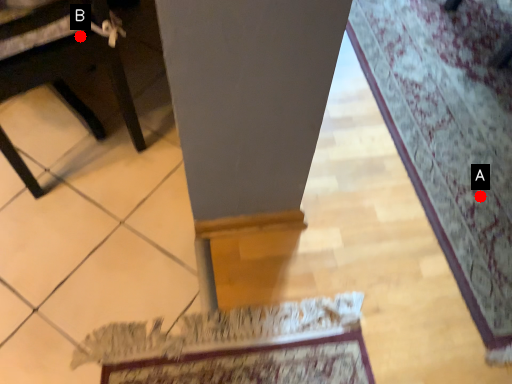
Question: Two points are circled on the image, labeled by A and B beside each circle. Which point appears closest to the camera in this image?

Choices:
 (A) A is closer
 (B) B is closer

Answer: (B)